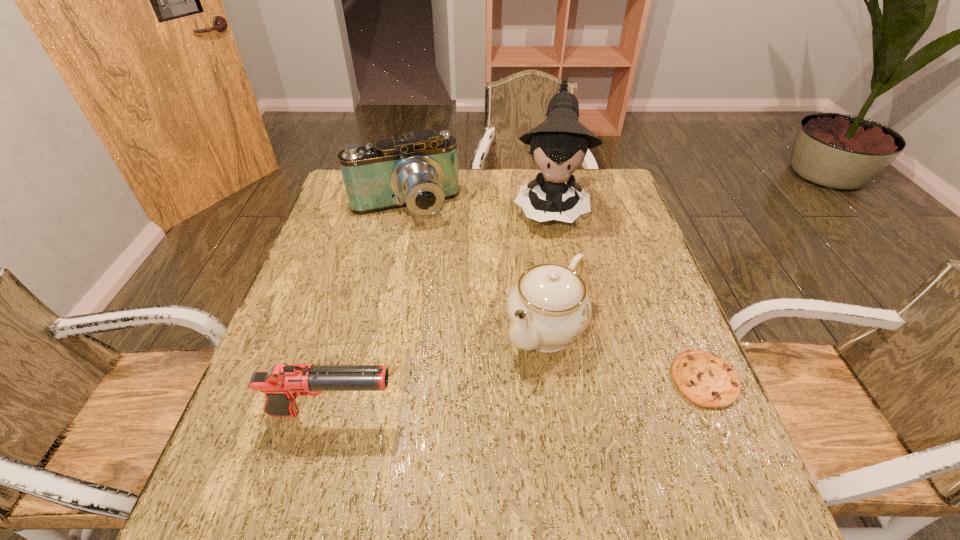
The height and width of the screenshot is (540, 960). In order to click on vacant region between the cookie and the doll in this screenshot , I will do `click(627, 292)`.

Identify the location of free space between the rightmost object and the second shortest object. (518, 396).

You are a GUI agent. You are given a task and a screenshot of the screen. Output one action in this format:
    pyautogui.click(x=<x>, y=<y>)
    Task: Click on the vacant space in between the cookie and the chinaware
    Image resolution: width=960 pixels, height=540 pixels.
    Given the screenshot: What is the action you would take?
    pyautogui.click(x=625, y=354)

Where is `empty space between the gun and the camcorder`? This screenshot has width=960, height=540. empty space between the gun and the camcorder is located at coordinates (369, 309).

Find the location of `free space between the fourth tallest object and the chinaware`. free space between the fourth tallest object and the chinaware is located at coordinates (439, 371).

Locate an element on the screen. The height and width of the screenshot is (540, 960). vacant point located between the camcorder and the tallest object is located at coordinates (477, 206).

Identify the location of vacant space that's between the doll and the shortest object. (627, 292).

The width and height of the screenshot is (960, 540). Identify the location of blank region between the doll and the gun. (441, 309).

This screenshot has width=960, height=540. I want to click on vacant point located between the cookie and the doll, so [627, 292].

I want to click on empty location between the gun and the chinaware, so click(439, 371).